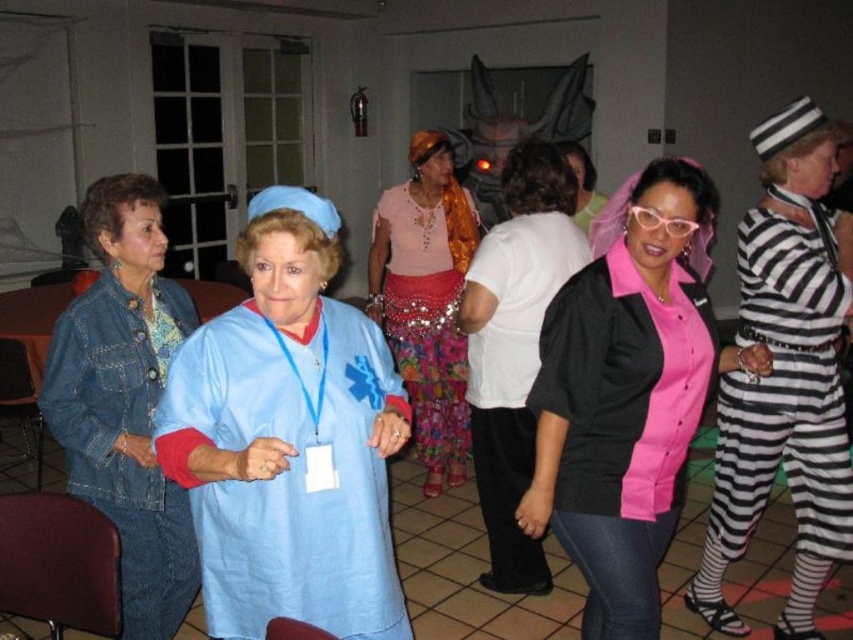
You are standing at the point marked as point (54,353) in the image and want to take a photo of the entire room. The camera you have can capture a maximum distance of 2 meters. Will you be able to capture the entire room in one shot?

The distance between point (54,353) and the camera is 2.19 meters, which exceeds the camera maximum distance of 2 meters. Therefore, you won t be able to capture the entire room in one shot.

You are taking a photo of the scene and want to focus on both the point at [663,509] and the point at [100,381]. Which point should you adjust your focus to first to ensure both are in the clearest possible view?

You should focus on point [663,509] first because it is closer to the camera than point [100,381]. By focusing on the closer point, the farther point will also be within the depth of field, ensuring both are in clear view.

You are a photographer at this costume party and need to capture a photo of both the matte blue scrubs at center and the pink matte shirt at center in the same frame. Given that your camera has a minimum focus distance of 60 centimeters, will you be able to focus on both subjects simultaneously?

The matte blue scrubs at center and pink matte shirt at center are 61.37 centimeters apart. Since the distance between them is greater than the camera minimum focus distance of 60 centimeters, the camera can focus on both subjects simultaneously.